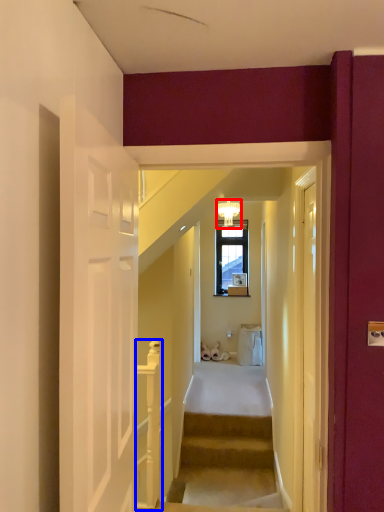
Question: Which of the following is the farthest to the observer, light fixture (highlighted by a red box) or rail (highlighted by a blue box)?

Choices:
 (A) light fixture
 (B) rail

Answer: (A)